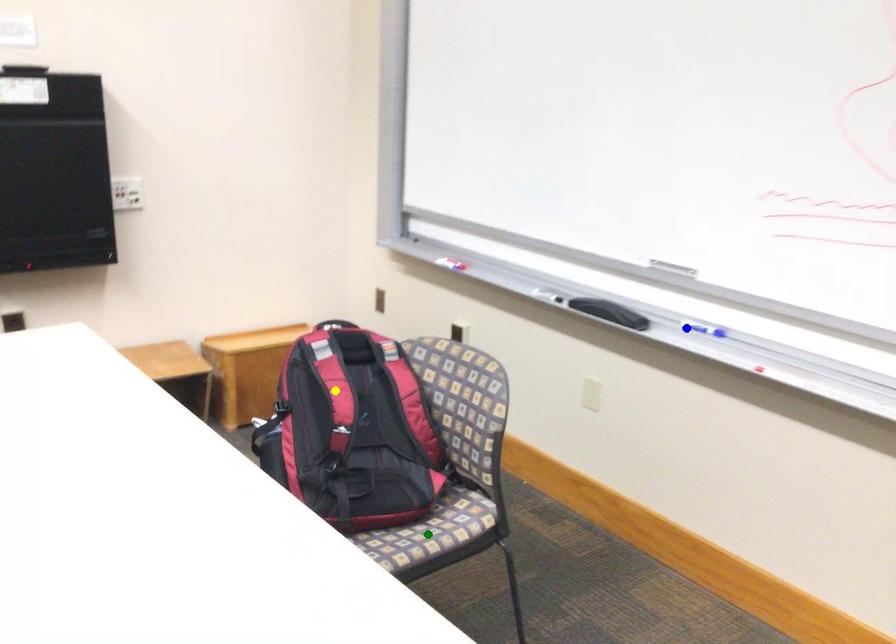
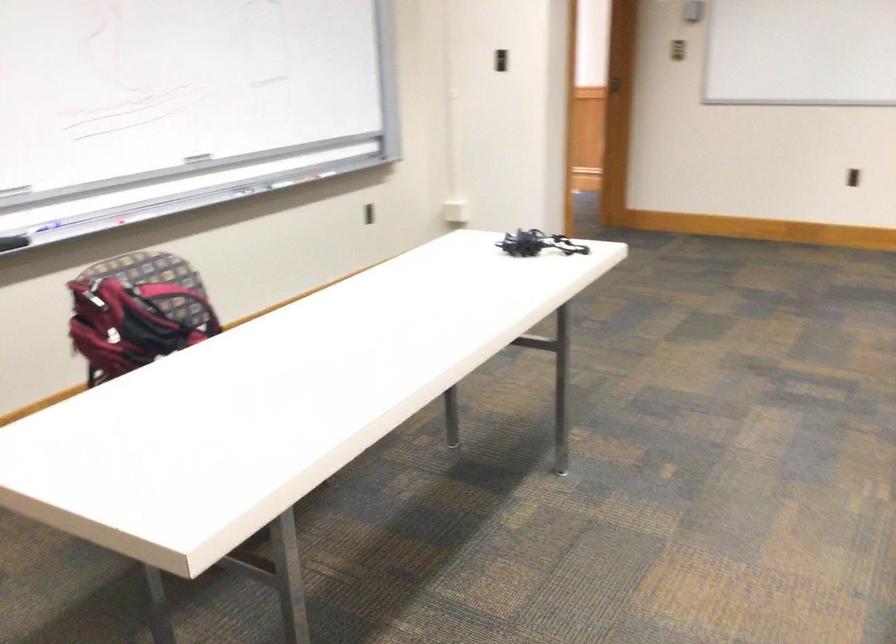
I am providing you with two images of the same scene from different viewpoints. Three points are marked in image1. Which point corresponds to a part or object that is occluded in image2?In image1, three points are marked. Which of them correspond to a part or object that is occluded in image2?Among the three points shown in image1, which one corresponds to a part or object that is no longer visible due to occlusion in image2?

green point, yellow point cannot be seen in image2.